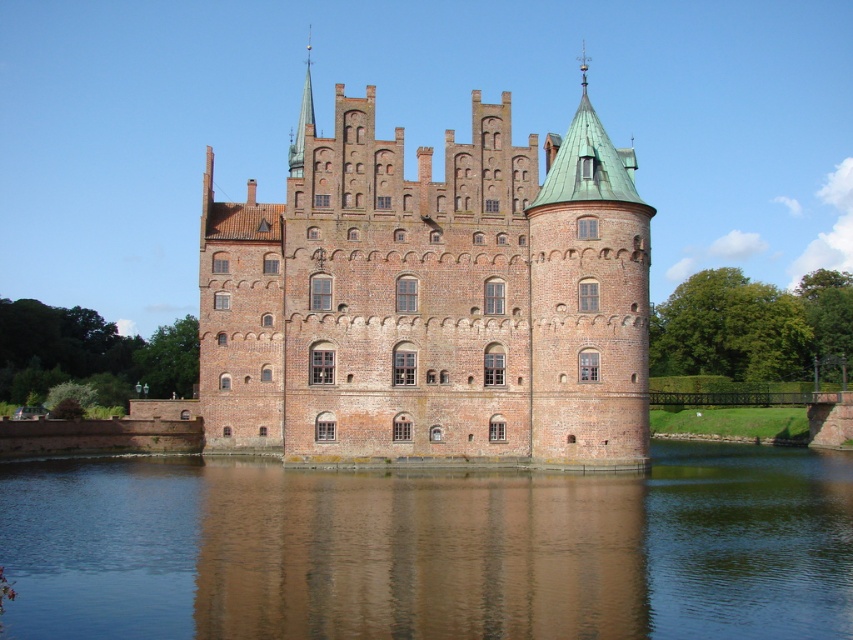
You are standing in front of the castle and notice two points marked on the castle wall. The first point is at coordinates point (x=509, y=502) and the second is at point (x=550, y=253). Which point is closer to your current position?

Point (x=509, y=502) is closer to the camera than point (x=550, y=253), so the first point is closer to your current position.